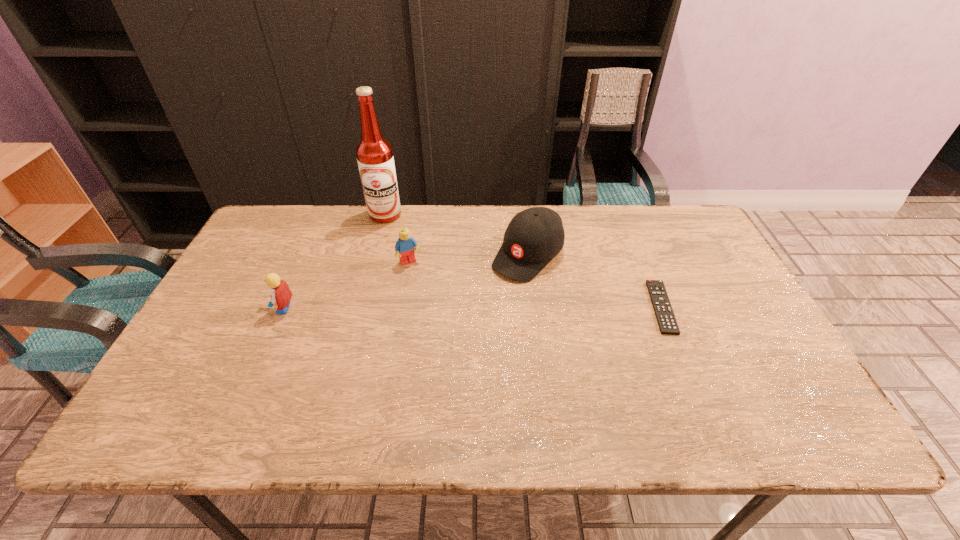
Identify the location of object that can be found as the fourth closest to the alcohol. The width and height of the screenshot is (960, 540). (666, 320).

Locate which object ranks second in proximity to the shortest object. Please provide its 2D coordinates. Your answer should be formatted as a tuple, i.e. [(x, y)], where the tuple contains the x and y coordinates of a point satisfying the conditions above.

[(404, 247)]

Locate an element on the screen. The image size is (960, 540). vacant area that satisfies the following two spatial constraints: 1. on the back side of the baseball cap; 2. on the left side of the right Lego is located at coordinates (411, 255).